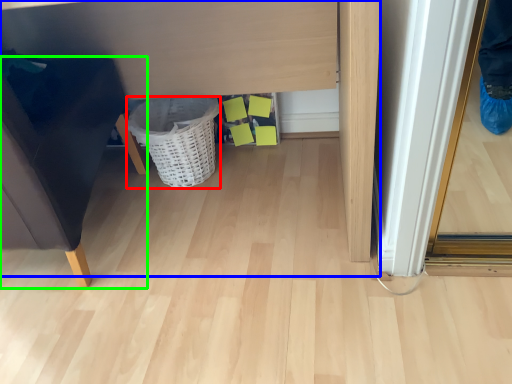
Question: Based on their relative distances, which object is farther from basket (highlighted by a red box)? Choose from vanity (highlighted by a blue box) and furniture (highlighted by a green box).

Choices:
 (A) vanity
 (B) furniture

Answer: (B)